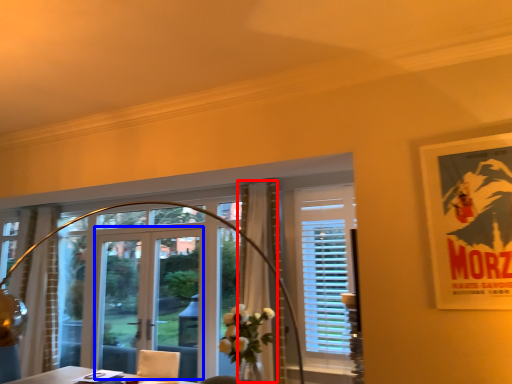
Question: Which of the following is the farthest to the observer, curtain (highlighted by a red box) or screen door (highlighted by a blue box)?

Choices:
 (A) curtain
 (B) screen door

Answer: (B)